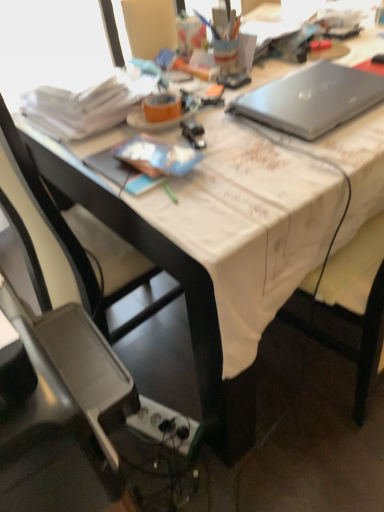
The image size is (384, 512). What are the coordinates of `free space above silver metallic laptop at upper right (from a real-world perspective)` in the screenshot? It's located at (316, 87).